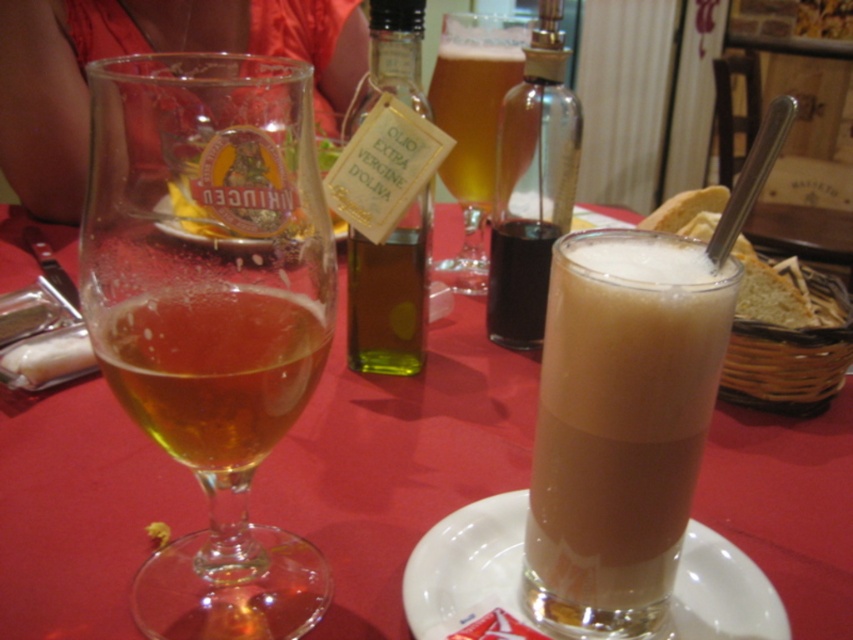
Question: Which point is closer to the camera taking this photo?

Choices:
 (A) (489, 525)
 (B) (479, 77)
 (C) (160, 392)

Answer: (C)

Question: Where is translucent glass at center located in relation to translucent amber liquid at left in the image?

Choices:
 (A) left
 (B) right

Answer: (B)

Question: Which point is closer to the camera?

Choices:
 (A) transparent glass wine glass at left
 (B) dark brown glass bottle at center
 (C) green glass bottle at center
 (D) translucent glass at center

Answer: (A)

Question: Is dark brown glass bottle at center to the right of translucent glass beer at center from the viewer's perspective?

Choices:
 (A) yes
 (B) no

Answer: (A)

Question: Does white ceramic plate at center have a greater width compared to dark brown glass bottle at center?

Choices:
 (A) no
 (B) yes

Answer: (B)

Question: Which is farther from the transparent glass wine glass at left?

Choices:
 (A) translucent amber liquid at left
 (B) translucent glass beer at center

Answer: (B)